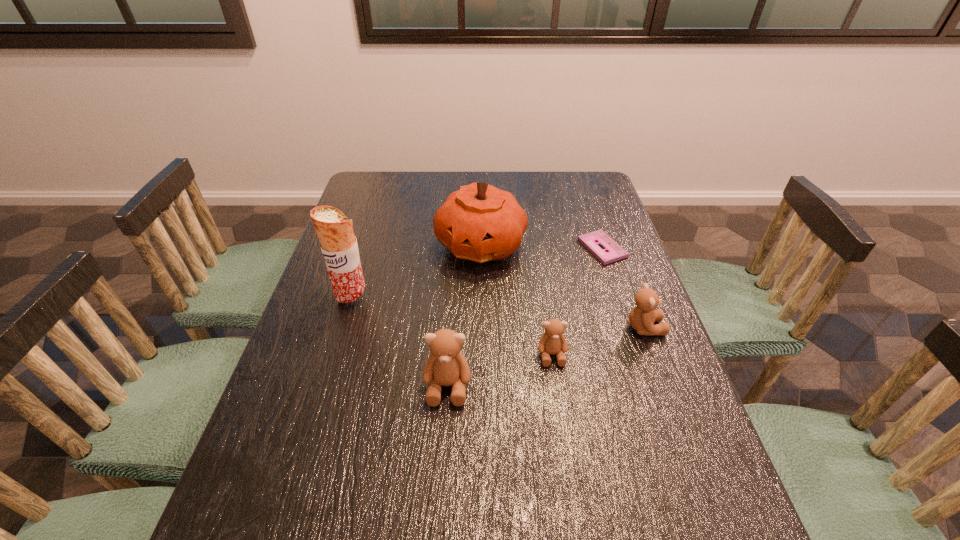
You are a GUI agent. You are given a task and a screenshot of the screen. Output one action in this format:
    pyautogui.click(x=<x>, y=<y>)
    Task: Click on the vacant space at the right edge of the desktop
    Image resolution: width=960 pixels, height=540 pixels.
    Given the screenshot: What is the action you would take?
    pyautogui.click(x=588, y=230)

In the image, there is a desktop. What are the coordinates of `vacant space at the far left corner` in the screenshot? It's located at (368, 189).

Identify the location of free space at the far right corner of the desktop. (558, 185).

The width and height of the screenshot is (960, 540). I want to click on empty space between the shortest object and the shortest teddy bear, so click(x=577, y=301).

Identify the location of free area in between the tallest teddy bear and the shortest object. (525, 317).

Where is `blank region between the tallest object and the fourth shortest object`? blank region between the tallest object and the fourth shortest object is located at coordinates (400, 341).

Where is `vacant space that is in between the second teddy bear from right to left and the third shortest object`? The image size is (960, 540). vacant space that is in between the second teddy bear from right to left and the third shortest object is located at coordinates tap(598, 341).

Locate an element on the screen. The height and width of the screenshot is (540, 960). unoccupied area between the second tallest teddy bear and the second shortest object is located at coordinates (598, 341).

Identify the location of free spot between the shortest object and the second tallest teddy bear. The image size is (960, 540). (623, 288).

In order to click on vacant space that's between the videotape and the third tallest object in this screenshot , I will do `click(525, 317)`.